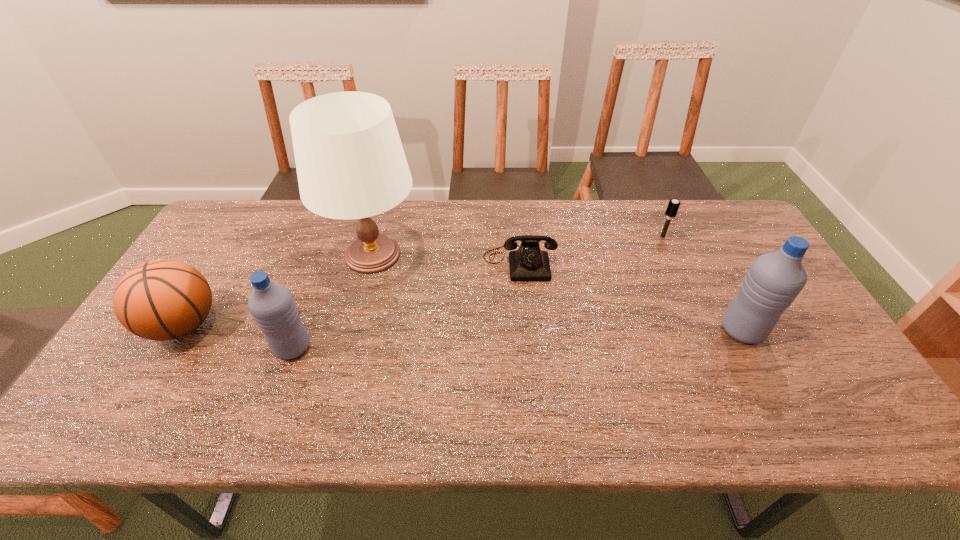
This screenshot has width=960, height=540. What are the coordinates of `the third shortest object` in the screenshot? It's located at (160, 300).

I want to click on vacant space located on the back of the shorter water bottle, so click(x=315, y=285).

Find the location of `free space located 0.290m on the left of the rightmost object`. free space located 0.290m on the left of the rightmost object is located at coordinates 609,330.

Identify the location of vacant space positioned 0.050m on the back of the second shortest object. coord(657,223).

You are a GUI agent. You are given a task and a screenshot of the screen. Output one action in this format:
    pyautogui.click(x=<x>, y=<y>)
    Task: Click on the free location located 0.330m on the front face of the fourth object from left to right
    This screenshot has height=540, width=960.
    Given the screenshot: What is the action you would take?
    pos(531,382)

Locate an element on the screen. Image resolution: width=960 pixels, height=540 pixels. free spot located 0.110m on the right of the lamp is located at coordinates (457, 255).

The image size is (960, 540). I want to click on free location located on the right of the third shortest object, so click(373, 325).

Where is `hairbrush that is positioned at the far edge`? Image resolution: width=960 pixels, height=540 pixels. hairbrush that is positioned at the far edge is located at coordinates (673, 206).

The image size is (960, 540). Find the location of `telephone present at the far edge`. telephone present at the far edge is located at coordinates (529, 263).

I want to click on lamp that is positioned at the far edge, so click(x=350, y=162).